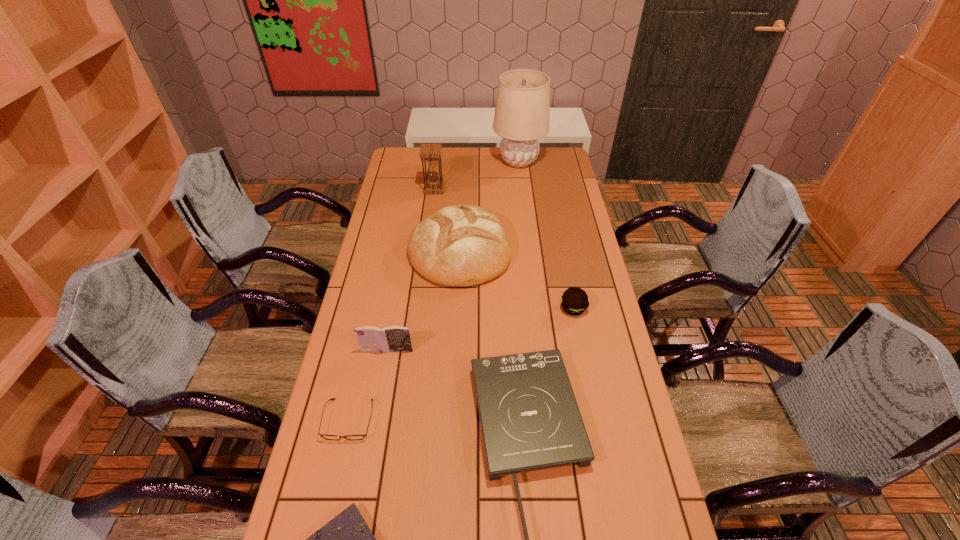
Locate an element on the screen. This screenshot has width=960, height=540. lampshade is located at coordinates click(522, 114).

At what (x,y) coordinates should I click in order to perform the action: click on the tallest object. Please return your answer as a coordinate pair (x, y). Looking at the image, I should click on (522, 114).

The height and width of the screenshot is (540, 960). Identify the location of hourglass. (431, 153).

The width and height of the screenshot is (960, 540). Identify the location of the second farthest object. (431, 153).

The width and height of the screenshot is (960, 540). Find the location of `bread`. bread is located at coordinates (460, 245).

At what (x,y) coordinates should I click in order to perform the action: click on the fifth farthest object. Please return your answer as a coordinate pair (x, y). The image size is (960, 540). Looking at the image, I should click on (393, 338).

Where is `the fourth shortest object`? Image resolution: width=960 pixels, height=540 pixels. the fourth shortest object is located at coordinates click(574, 301).

Locate an element on the screen. This screenshot has height=540, width=960. the fifth nearest object is located at coordinates (574, 301).

Where is `the seventh tallest object`? the seventh tallest object is located at coordinates (328, 437).

Find the location of a particular element. The height and width of the screenshot is (540, 960). vacant space situated on the front of the lampshade is located at coordinates (521, 185).